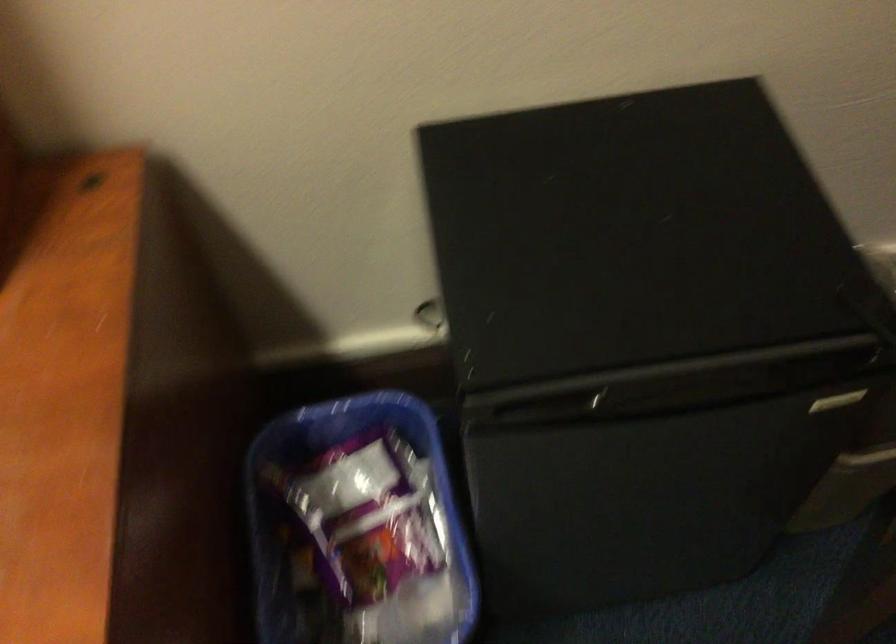
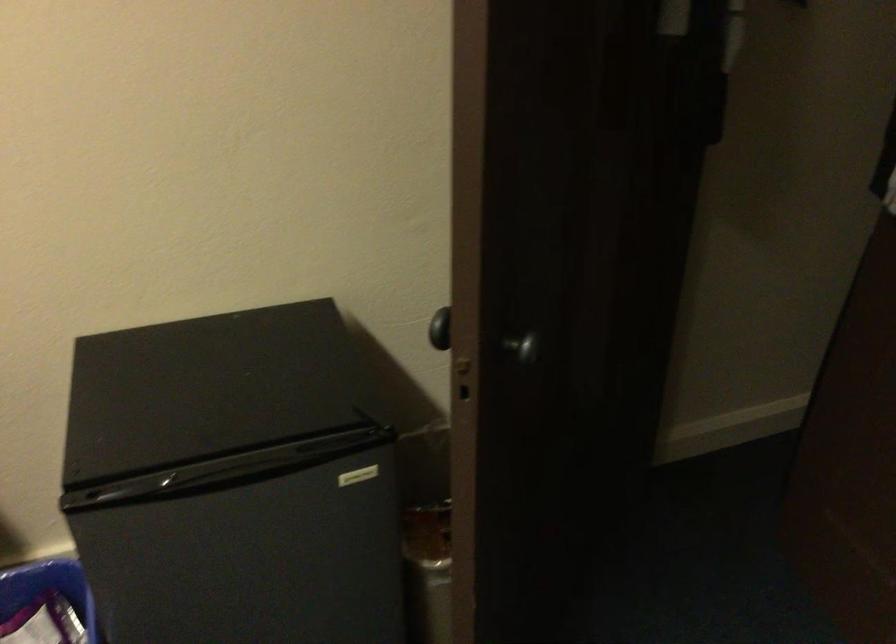
In a continuous first-person perspective shot, in which direction is the camera moving?

The cameraman walked toward right, backward.